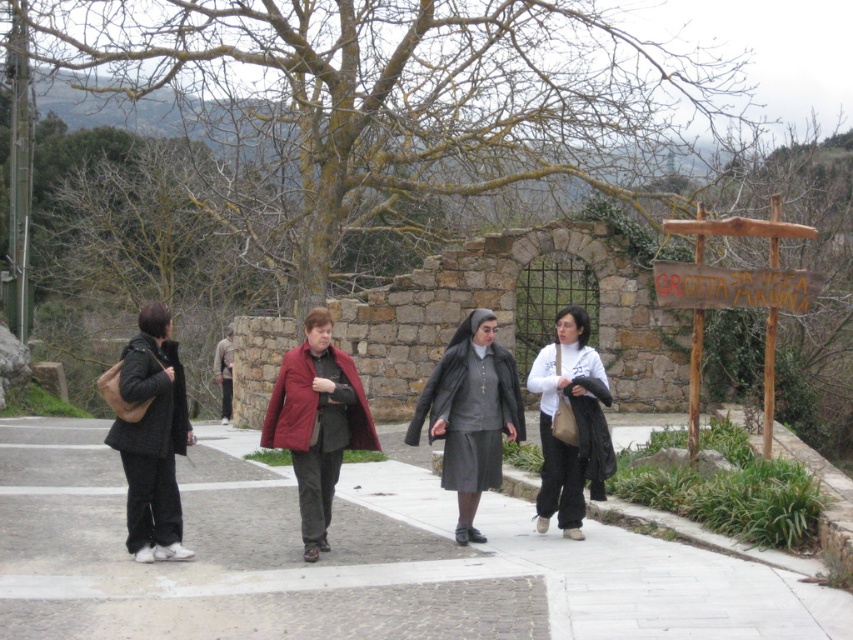
Question: Is matte red coat at center positioned at the back of matte black jacket at left?

Choices:
 (A) yes
 (B) no

Answer: (A)

Question: Which of the following is the farthest from the observer?

Choices:
 (A) white concrete pavement at lower center
 (B) wooden sign at right
 (C) white matte jacket at center

Answer: (B)

Question: Does white concrete pavement at lower center appear on the right side of wooden sign at right?

Choices:
 (A) yes
 (B) no

Answer: (B)

Question: Does matte black jacket at left have a greater width compared to white matte jacket at center?

Choices:
 (A) yes
 (B) no

Answer: (B)

Question: Which of the following is the closest to the observer?

Choices:
 (A) (129, 426)
 (B) (323, 472)
 (C) (50, 618)

Answer: (C)

Question: Which object is the closest to the wooden sign at right?

Choices:
 (A) white concrete pavement at lower center
 (B) white matte jacket at center
 (C) matte black jacket at left
 (D) matte red coat at center

Answer: (B)